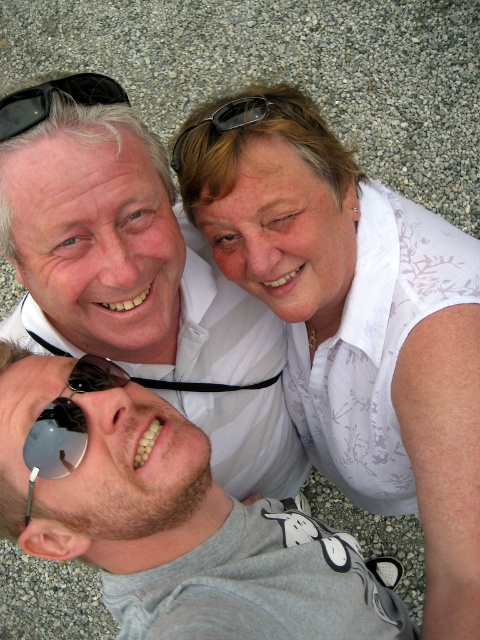
Question: Among these points, which one is farthest from the camera?

Choices:
 (A) click(97, 88)
 (B) click(78, 317)
 (C) click(446, 625)

Answer: (C)

Question: Which point is closer to the camera taking this photo?

Choices:
 (A) (257, 273)
 (B) (179, 141)
 (C) (263, 554)
 (D) (47, 465)

Answer: (D)

Question: Is white matte shirt at upper center behind black rubber sunglasses at upper left?

Choices:
 (A) no
 (B) yes

Answer: (B)

Question: Based on their relative distances, which object is nearer to the gray matte t-shirt at lower left?

Choices:
 (A) white floral blouse at upper center
 (B) black rubber sunglasses at upper left

Answer: (A)

Question: Observing the image, what is the correct spatial positioning of gray matte t-shirt at lower left in reference to black rubber sunglasses at upper left?

Choices:
 (A) right
 (B) left

Answer: (A)

Question: Is white matte shirt at upper center to the left of gray matte t-shirt at lower left from the viewer's perspective?

Choices:
 (A) yes
 (B) no

Answer: (A)